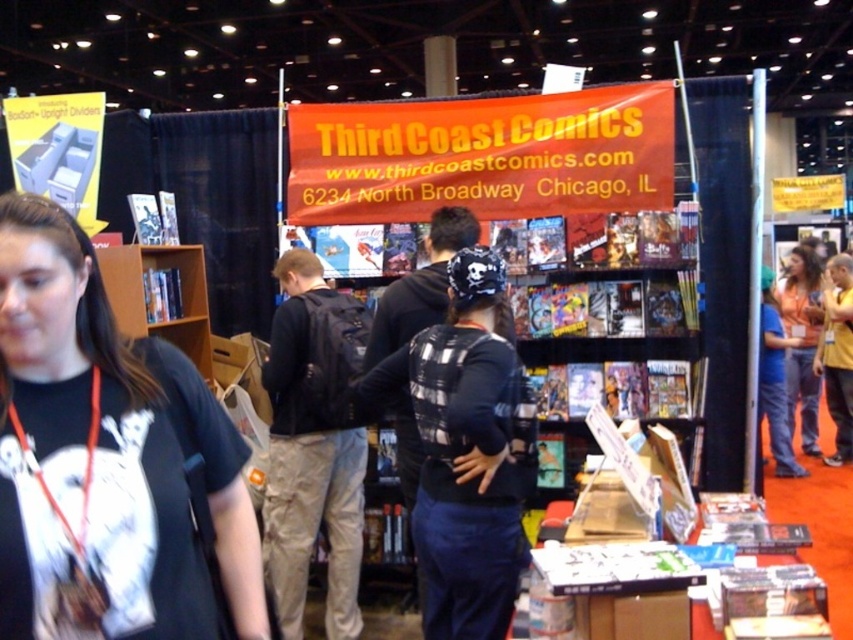
Can you confirm if black plaid shirt at center is positioned to the right of blue denim jeans at lower right?

In fact, black plaid shirt at center is to the left of blue denim jeans at lower right.

Can you confirm if black plaid shirt at center is positioned above blue denim jeans at lower right?

Yes.

Does point (428, 490) come in front of point (781, 467)?

Yes, point (428, 490) is closer to viewer.

At what (x,y) coordinates should I click in order to perform the action: click on black plaid shirt at center. Please return your answer as a coordinate pair (x, y). This screenshot has width=853, height=640. Looking at the image, I should click on (466, 451).

Who is higher up, wooden bookshelf at left or orange fabric at right?

wooden bookshelf at left is above.

Who is more forward, (138, 314) or (810, 433)?

Point (138, 314) is more forward.

The width and height of the screenshot is (853, 640). In order to click on wooden bookshelf at left in this screenshot , I will do coord(154,296).

Which is more to the right, black plaid shirt at center or dark gray backpack at center?

From the viewer's perspective, black plaid shirt at center appears more on the right side.

Does black plaid shirt at center have a greater width compared to dark gray backpack at center?

Indeed, black plaid shirt at center has a greater width compared to dark gray backpack at center.

Who is more forward, (x=480, y=432) or (x=282, y=284)?

Point (x=480, y=432) is more forward.

Identify the location of black plaid shirt at center. (466, 451).